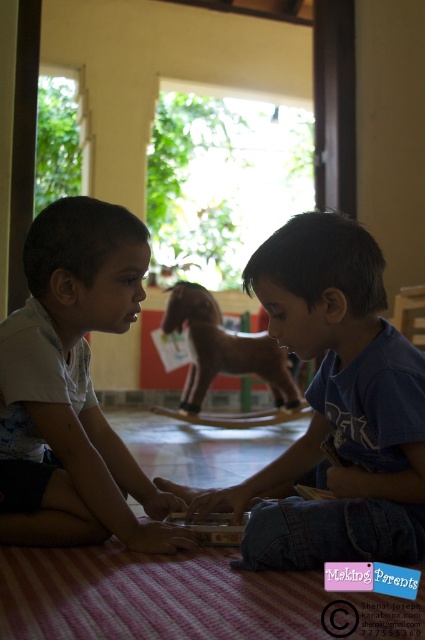
You are a photographer trying to capture a candid shot of the two boys. You notice the blue cotton shirt at center and the white matte shirt at left. Which shirt should you adjust to ensure both are equally visible in the frame?

The blue cotton shirt at center has a lesser height compared to white matte shirt at left. To make them equally visible, you should adjust the blue cotton shirt at center to be positioned higher or the white matte shirt at left to be lowered.

You are a photographer trying to capture a closeup of the wooden horse at center without the blue cotton shirt at center blocking it. What should you do?

The blue cotton shirt at center is positioned over the wooden horse at center, so you should move the blue cotton shirt at center to the side to reveal the wooden horse at center.